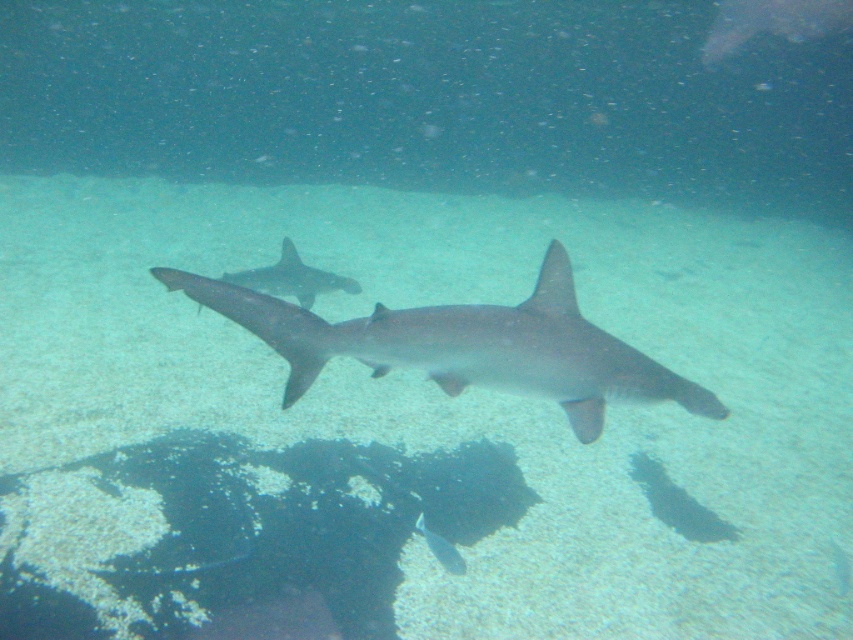
Question: Is gray matte shark at center to the left of shiny silver fish at center from the viewer's perspective?

Choices:
 (A) no
 (B) yes

Answer: (A)

Question: Which of the following is the closest to the observer?

Choices:
 (A) gray matte shark at center
 (B) shiny silver fish at center

Answer: (A)

Question: Is gray matte shark at center closer to the viewer compared to shiny silver fish at center?

Choices:
 (A) yes
 (B) no

Answer: (A)

Question: Is gray matte shark at center thinner than shiny silver fish at center?

Choices:
 (A) yes
 (B) no

Answer: (B)

Question: Which of the following is the closest to the observer?

Choices:
 (A) gray matte shark at center
 (B) shiny silver fish at center

Answer: (A)